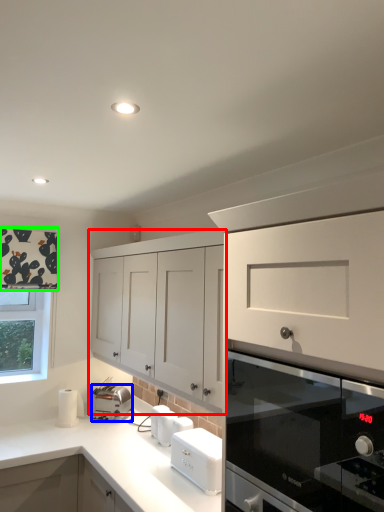
Question: Estimate the real-world distances between objects in this image. Which object is closer to cabinetry (highlighted by a red box), kitchen appliance (highlighted by a blue box) or curtain (highlighted by a green box)?

Choices:
 (A) kitchen appliance
 (B) curtain

Answer: (B)